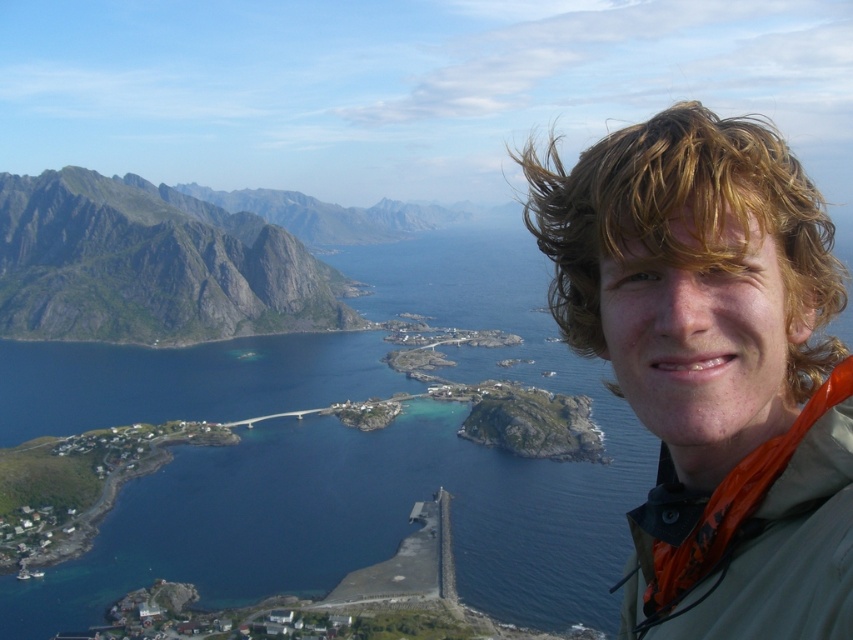
Locate an element on the screen. Image resolution: width=853 pixels, height=640 pixels. blue water at center is located at coordinates (383, 476).

Is blue water at center further to camera compared to gray rocky mountain at left?

No, blue water at center is closer to the viewer.

Between point (560, 576) and point (15, 189), which one is positioned behind?

Positioned behind is point (15, 189).

Image resolution: width=853 pixels, height=640 pixels. Identify the location of blue water at center. (383, 476).

Between blue water at center and blonde curly hair at upper right, which one is positioned lower?

Positioned lower is blue water at center.

Who is positioned more to the left, blue water at center or blonde curly hair at upper right?

Positioned to the left is blue water at center.

Does point (393, 502) come in front of point (772, 136)?

No, (393, 502) is further to viewer.

Find the location of `blue water at center`. blue water at center is located at coordinates (383, 476).

Can you confirm if gray rocky mountain at left is positioned below blonde curly hair at upper right?

Actually, gray rocky mountain at left is above blonde curly hair at upper right.

Does gray rocky mountain at left have a smaller size compared to blonde curly hair at upper right?

Correct, gray rocky mountain at left occupies less space than blonde curly hair at upper right.

Is point (151, 248) closer to camera compared to point (805, 385)?

No, it is not.

I want to click on gray rocky mountain at left, so click(151, 266).